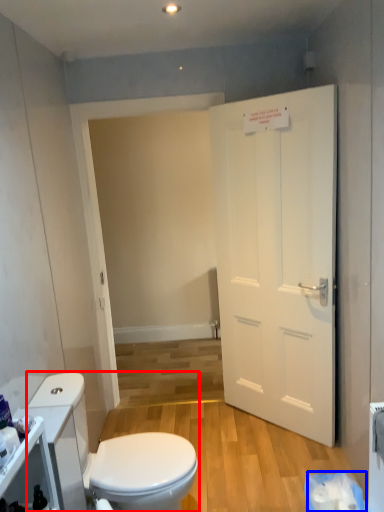
Question: Which of the following is the farthest to the observer, toilet (highlighted by a red box) or toilet paper (highlighted by a blue box)?

Choices:
 (A) toilet
 (B) toilet paper

Answer: (B)